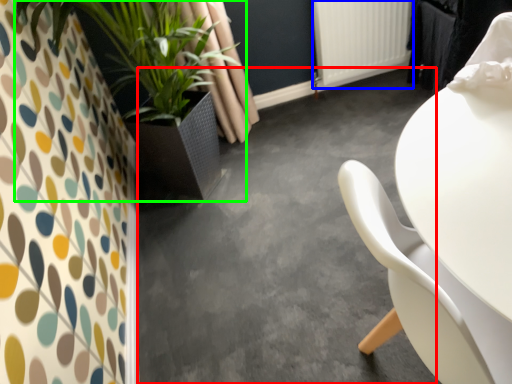
Question: Which is nearer to the concrete (highlighted by a red box)? radiator (highlighted by a blue box) or houseplant (highlighted by a green box).

Choices:
 (A) radiator
 (B) houseplant

Answer: (B)